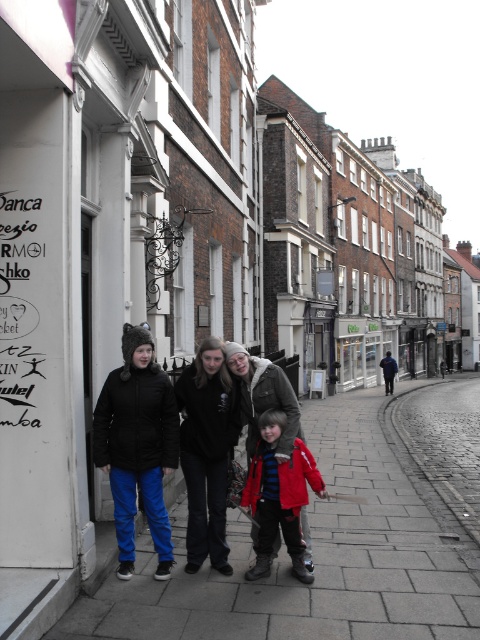
Question: Is smooth concrete pavement at center smaller than red matte jacket at center?

Choices:
 (A) no
 (B) yes

Answer: (A)

Question: Which of the following is the closest to the observer?

Choices:
 (A) (228, 444)
 (B) (307, 428)
 (C) (268, 493)

Answer: (C)

Question: Which of these objects is positioned farthest from the red matte jacket at center?

Choices:
 (A) smooth concrete pavement at center
 (B) matte black jackets at center

Answer: (A)

Question: Which of the following is the farthest from the observer?

Choices:
 (A) smooth concrete pavement at center
 (B) red matte jacket at center
 (C) matte black jackets at center

Answer: (B)

Question: From the image, what is the correct spatial relationship of smooth concrete pavement at center in relation to red matte jacket at center?

Choices:
 (A) below
 (B) above

Answer: (A)

Question: Can you confirm if matte black jackets at center is smaller than red matte jacket at center?

Choices:
 (A) no
 (B) yes

Answer: (A)